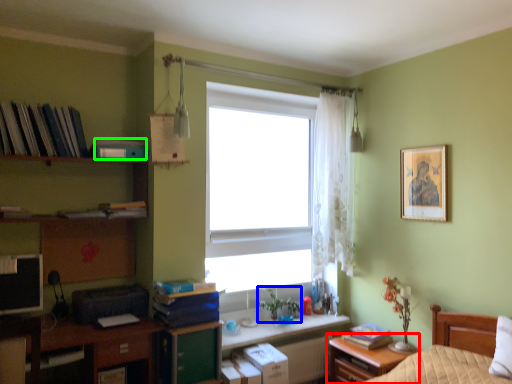
Question: Estimate the real-world distances between objects in this image. Which object is closer to nightstand (highlighted by a red box), plant (highlighted by a blue box) or book (highlighted by a green box)?

Choices:
 (A) plant
 (B) book

Answer: (A)